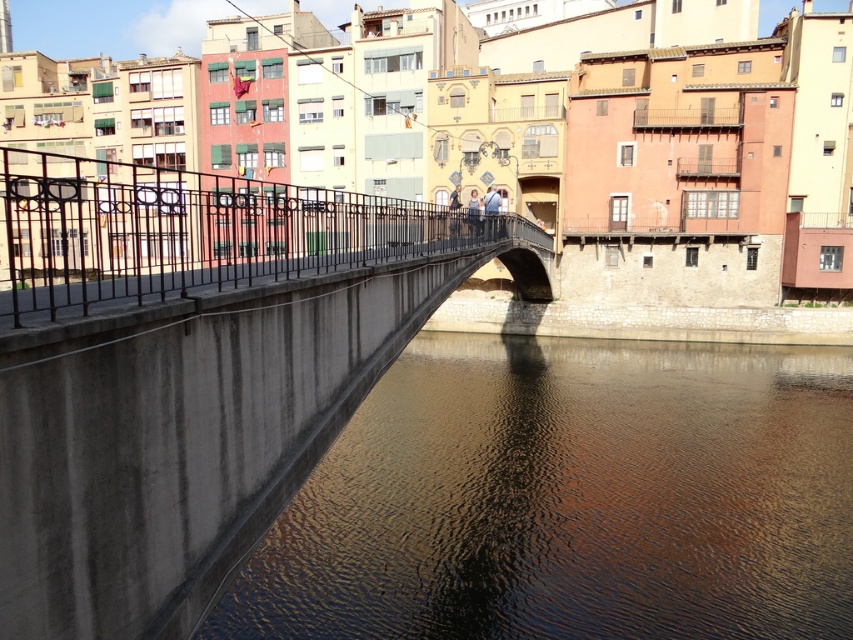
You are a fashion designer observing a model wearing both the matte blue jeans at center and the matte blue shirt at center. Which piece of clothing is more likely to be part of a coordinated outfit based on their size relationship?

The matte blue jeans at center has a larger size compared to matte blue shirt at center, so the coordinated outfit would likely feature the matte blue shirt at center as it is smaller and more proportionate to the model.

You are standing on the pedestrian bridge and notice two elements in the scene. One is the brown concrete water at lower left and the other is the black wrought iron railing at upper left. Based on their positions, which one would you see first if you look towards the center of the bridge?

The brown concrete water at lower left is to the right of the black wrought iron railing at upper left. Since you are facing the center of the bridge, you would see the black wrought iron railing at upper left first before the brown concrete water at lower left.

You are a photographer standing on the concrete bridge at center and want to take a photo of the matte blue shirt at center. Considering the height difference between the two, will the shirt be fully visible in the photo without any obstruction?

The concrete bridge at center is taller than the matte blue shirt at center. Since the bridge is higher, it might block the view of the shirt unless you adjust your angle or position to ensure the shirt is not obscured by the bridge structure.